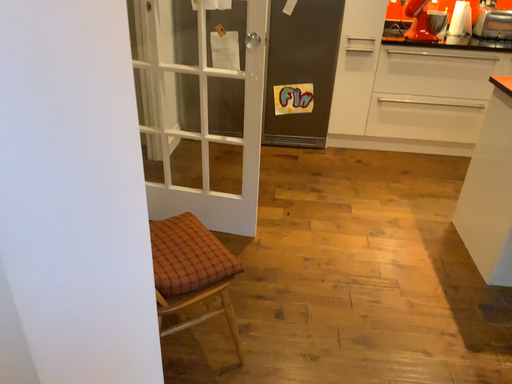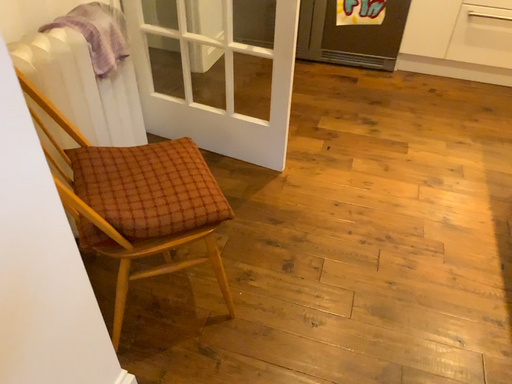
Question: Which way did the camera rotate in the video?

Choices:
 (A) rotated upward
 (B) rotated downward

Answer: (B)